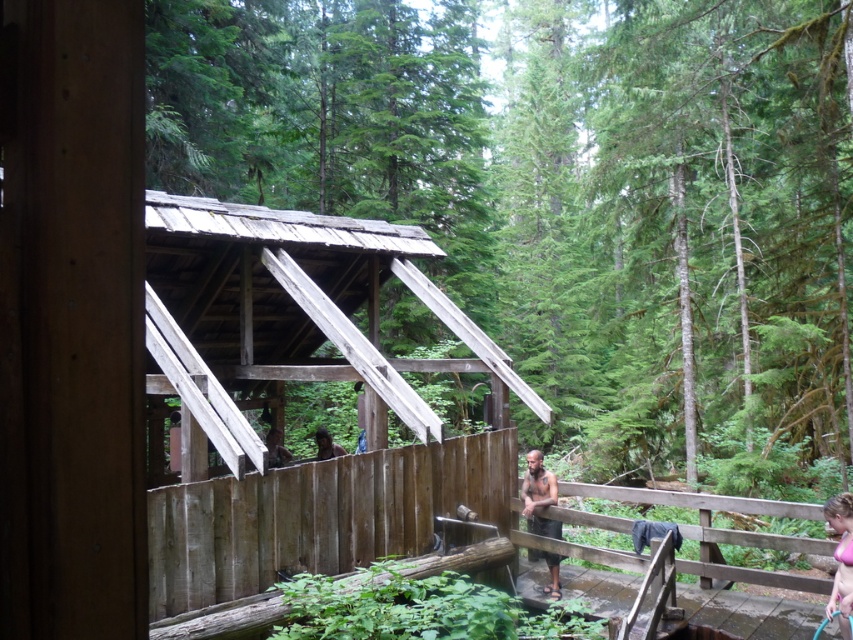
Which of these two, weathered wood hut at center or pink fabric at lower right, stands taller?

pink fabric at lower right is taller.

Who is more forward, (227, 212) or (843, 548)?

Point (843, 548)

The width and height of the screenshot is (853, 640). Find the location of `weathered wood hut at center`. weathered wood hut at center is located at coordinates (283, 404).

Between smooth wooden structure at center and dark brown skin at center, which one has more height?

smooth wooden structure at center is taller.

Does smooth wooden structure at center appear on the right side of dark brown skin at center?

Yes, smooth wooden structure at center is to the right of dark brown skin at center.

Between point (570, 102) and point (552, 524), which one is positioned behind?

The point (570, 102) is more distant.

Where is `smooth wooden structure at center`? This screenshot has height=640, width=853. smooth wooden structure at center is located at coordinates (567, 196).

Is weathered wood hut at center further to camera compared to wooden fence at center?

Yes, weathered wood hut at center is behind wooden fence at center.

Between point (492, 358) and point (461, 454), which one is positioned in front?

Point (461, 454) is in front.

The image size is (853, 640). Identify the location of weathered wood hut at center. (283, 404).